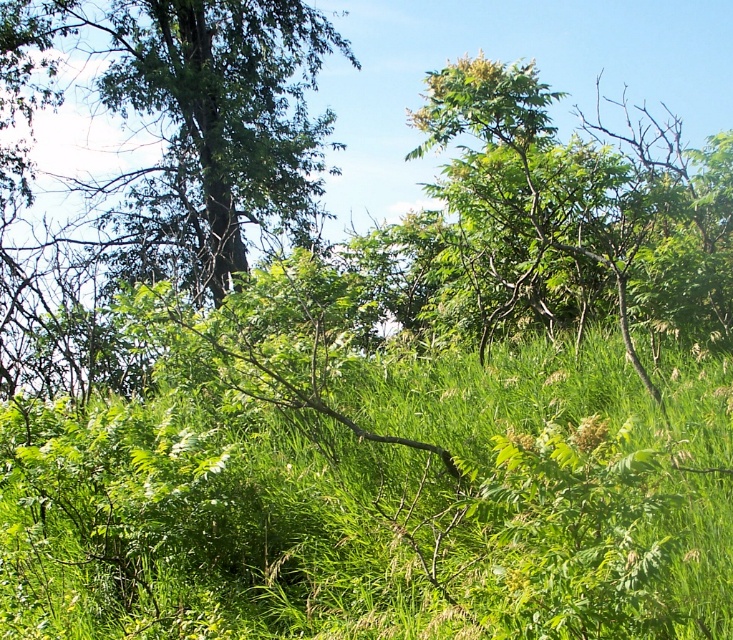
Who is shorter, green leafy grass at center or green leafy tree at upper left?

Standing shorter between the two is green leafy tree at upper left.

Can you confirm if green leafy grass at center is positioned to the right of green leafy tree at upper left?

Yes, green leafy grass at center is to the right of green leafy tree at upper left.

Where is `green leafy grass at center`? The image size is (733, 640). green leafy grass at center is located at coordinates (377, 508).